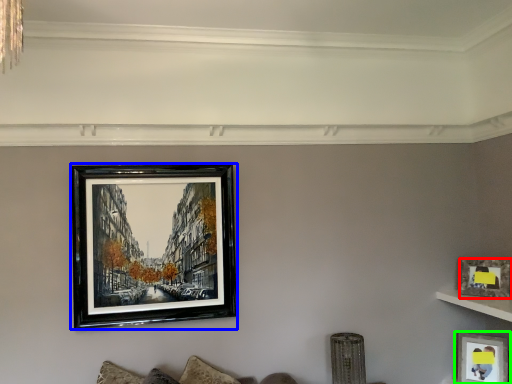
Question: Which object is positioned farthest from picture frame (highlighted by a red box)? Select from picture frame (highlighted by a blue box) and picture frame (highlighted by a green box).

Choices:
 (A) picture frame
 (B) picture frame

Answer: (A)